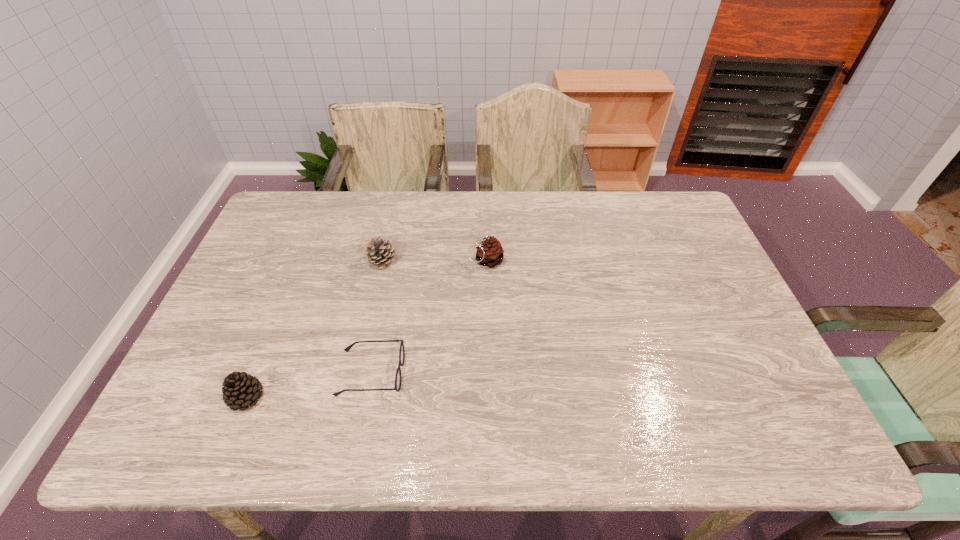
In order to click on object identified as the closest to the nearest pinecone in this screenshot , I will do `click(398, 378)`.

Point out which object is positioned as the third nearest to the spectacles. Please provide its 2D coordinates. Your answer should be formatted as a tuple, i.e. [(x, y)], where the tuple contains the x and y coordinates of a point satisfying the conditions above.

[(490, 253)]

What are the coordinates of `pinecone that is the second nearest to the second pinecone from left to right` in the screenshot? It's located at (241, 390).

Locate an element on the screen. The width and height of the screenshot is (960, 540). the second closest pinecone to the second pinecone from left to right is located at coordinates (241, 390).

This screenshot has height=540, width=960. I want to click on blank space that satisfies the following two spatial constraints: 1. with a leaf charm attached to the rightmost object; 2. on the front side of the second pinecone from left to right, so click(x=486, y=261).

In order to click on vacant space that satisfies the following two spatial constraints: 1. with a leaf charm attached to the rightmost pinecone; 2. on the front side of the second pinecone from right to left in this screenshot , I will do `click(486, 261)`.

The height and width of the screenshot is (540, 960). I want to click on vacant space that satisfies the following two spatial constraints: 1. on the front side of the second pinecone from right to left; 2. at the narrow end of the leftmost pinecone, so click(x=352, y=397).

This screenshot has width=960, height=540. I want to click on vacant position in the image that satisfies the following two spatial constraints: 1. with a leaf charm attached to the rightmost pinecone; 2. on the front side of the second pinecone from right to left, so click(486, 261).